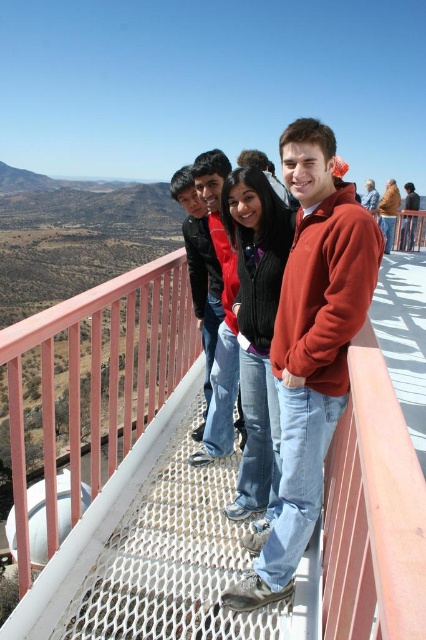
Question: Does metal mesh balcony at center lie in front of matte red jacket at center?

Choices:
 (A) no
 (B) yes

Answer: (B)

Question: Is matte orange fleece at center wider than matte orange jacket at center?

Choices:
 (A) no
 (B) yes

Answer: (A)

Question: In this image, where is orange cotton sweater at center located relative to matte orange sweater at center?

Choices:
 (A) above
 (B) below

Answer: (B)

Question: Which of the following is the closest to the observer?

Choices:
 (A) matte orange jacket at center
 (B) matte orange fleece at center

Answer: (B)

Question: Which of the following is the closest to the observer?

Choices:
 (A) matte orange sweater at center
 (B) matte orange fleece at center

Answer: (B)

Question: Estimate the real-world distances between objects in this image. Which object is closer to the orange cotton sweater at center?

Choices:
 (A) matte orange sweater at center
 (B) matte orange jacket at center
 (C) matte orange fleece at center

Answer: (B)